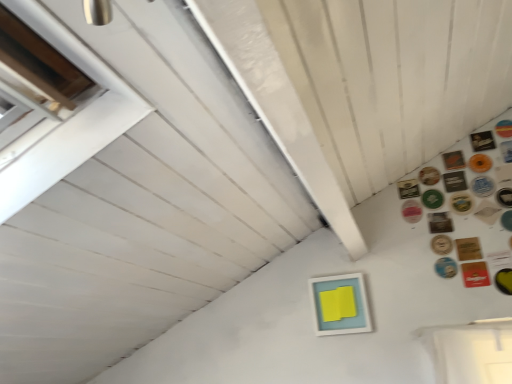
What do you see at coordinates (429, 176) in the screenshot?
I see `gold metallic coaster at upper right, marked as the fourth button in a top-to-bottom arrangement` at bounding box center [429, 176].

What is the approximate height of brown leather coaster at upper right, the eighth button viewed from the top?

3.78 inches.

You are a GUI agent. You are given a task and a screenshot of the screen. Output one action in this format:
    pyautogui.click(x=<x>, y=<y>)
    Task: Click on the brown leather coaster at upper right, which ranks as the 10th button in bottom-to-top order
    Image resolution: width=512 pixels, height=384 pixels.
    Given the screenshot: What is the action you would take?
    504,197

The width and height of the screenshot is (512, 384). In order to click on green matte button at upper right, placed as the ninth button when sorted from top to bottom in this screenshot , I will do `click(432, 199)`.

Describe the element at coordinates (440, 223) in the screenshot. I see `black matte button at upper right, the sixth button when ordered from bottom to top` at that location.

Image resolution: width=512 pixels, height=384 pixels. What do you see at coordinates (506, 151) in the screenshot?
I see `orange matte coaster at upper right, the sixteenth button when ordered from bottom to top` at bounding box center [506, 151].

In order to click on green rubber button at upper right, which is counted as the tenth button, starting from the top in this screenshot , I will do coord(461,203).

Locate an element on the screen. Image resolution: width=512 pixels, height=384 pixels. gold metallic coaster at upper right, marked as the fourth button in a top-to-bottom arrangement is located at coordinates (429, 176).

Which object is thinner, green matte button at upper right, placed as the ninth button when sorted from top to bottom, or gold metallic button at upper right, placed as the eleventh button when sorted from bottom to top?

gold metallic button at upper right, placed as the eleventh button when sorted from bottom to top.

Where is `the 2nd button positioned above the green matte button at upper right, placed as the ninth button when sorted from top to bottom (from a real-world perspective)`? the 2nd button positioned above the green matte button at upper right, placed as the ninth button when sorted from top to bottom (from a real-world perspective) is located at coordinates (x=408, y=189).

Considering the points (438, 190) and (404, 187), which point is in front, point (438, 190) or point (404, 187)?

Positioned in front is point (438, 190).

Does green matte button at upper right, the ninth button from the bottom, touch gold metallic button at upper right, placed as the eleventh button when sorted from bottom to top?

Yes, green matte button at upper right, the ninth button from the bottom, is with gold metallic button at upper right, placed as the eleventh button when sorted from bottom to top.

Is orange matte coaster at upper right, placed as the second button when sorted from top to bottom, at the back of wooden button at upper right, arranged as the 14th button when viewed from the top?

wooden button at upper right, arranged as the 14th button when viewed from the top, does not have its back to orange matte coaster at upper right, placed as the second button when sorted from top to bottom.

Do you think wooden button at upper right, the 4th button ordered from the bottom, is within orange matte coaster at upper right, placed as the second button when sorted from top to bottom, or outside of it?

wooden button at upper right, the 4th button ordered from the bottom, is not inside orange matte coaster at upper right, placed as the second button when sorted from top to bottom, it's outside.

Who is taller, wooden button at upper right, arranged as the 14th button when viewed from the top, or orange matte coaster at upper right, placed as the second button when sorted from top to bottom?

orange matte coaster at upper right, placed as the second button when sorted from top to bottom, is taller.

Between wooden button at upper right, arranged as the 14th button when viewed from the top, and orange matte coaster at upper right, placed as the second button when sorted from top to bottom, which one has larger size?

With larger size is orange matte coaster at upper right, placed as the second button when sorted from top to bottom.

From the image's perspective, between gold metallic coaster at upper right, marked as the fourth button in a top-to-bottom arrangement, and brown leather coaster at upper right, the third button when ordered from top to bottom, who is located below?

gold metallic coaster at upper right, marked as the fourth button in a top-to-bottom arrangement, appears lower in the image.

From a real-world perspective, relative to brown leather coaster at upper right, the third button when ordered from top to bottom, is gold metallic coaster at upper right, marked as the 14th button in a bottom-to-top arrangement, vertically above or below?

gold metallic coaster at upper right, marked as the 14th button in a bottom-to-top arrangement, is situated lower than brown leather coaster at upper right, the third button when ordered from top to bottom, in the real world.

Does gold metallic coaster at upper right, marked as the 14th button in a bottom-to-top arrangement, have a larger size compared to brown leather coaster at upper right, which is counted as the fifteenth button, starting from the bottom?

Yes, gold metallic coaster at upper right, marked as the 14th button in a bottom-to-top arrangement, is bigger than brown leather coaster at upper right, which is counted as the fifteenth button, starting from the bottom.

Is gold metallic button at upper right, the 7th button positioned from the top, oriented towards red cardboard button at upper right, positioned as the sixteenth button in top-to-bottom order?

A: No, gold metallic button at upper right, the 7th button positioned from the top, is not oriented towards red cardboard button at upper right, positioned as the sixteenth button in top-to-bottom order.

From the picture: In terms of height, does gold metallic button at upper right, the 7th button positioned from the top, look taller or shorter compared to red cardboard button at upper right, which is the 2th button from bottom to top?

In the image, gold metallic button at upper right, the 7th button positioned from the top, appears to be shorter than red cardboard button at upper right, which is the 2th button from bottom to top.

Is gold metallic button at upper right, the 7th button positioned from the top, in front of or behind red cardboard button at upper right, positioned as the sixteenth button in top-to-bottom order, in the image?

In the image, gold metallic button at upper right, the 7th button positioned from the top, appears behind red cardboard button at upper right, positioned as the sixteenth button in top-to-bottom order.

There is a red cardboard button at upper right, which is the 2th button from bottom to top. Find the location of `the 10th button above it (from a real-world perspective)`. the 10th button above it (from a real-world perspective) is located at coordinates (408, 189).

From the image's perspective, which is above, red cardboard button at upper right, which is the 2th button from bottom to top, or brown leather coaster at upper right, which ranks as the 10th button in bottom-to-top order?

brown leather coaster at upper right, which ranks as the 10th button in bottom-to-top order, is shown above in the image.

Considering the sizes of red cardboard button at upper right, positioned as the sixteenth button in top-to-bottom order, and brown leather coaster at upper right, which ranks as the 10th button in bottom-to-top order, in the image, is red cardboard button at upper right, positioned as the sixteenth button in top-to-bottom order, wider or thinner than brown leather coaster at upper right, which ranks as the 10th button in bottom-to-top order,?

Clearly, red cardboard button at upper right, positioned as the sixteenth button in top-to-bottom order, has more width compared to brown leather coaster at upper right, which ranks as the 10th button in bottom-to-top order.

From the picture: Which object is positioned more to the right, red cardboard button at upper right, which is the 2th button from bottom to top, or brown leather coaster at upper right, which ranks as the 10th button in bottom-to-top order?

Positioned to the right is brown leather coaster at upper right, which ranks as the 10th button in bottom-to-top order.

Which is closer, (465, 263) or (508, 197)?

The point (465, 263) is closer.

Which of these two, light blue matte picture frame at center or black matte button at upper right, the 12th button positioned from the top, stands shorter?

black matte button at upper right, the 12th button positioned from the top, is shorter.

In the scene shown: Considering the sizes of light blue matte picture frame at center and black matte button at upper right, the 12th button positioned from the top, in the image, is light blue matte picture frame at center bigger or smaller than black matte button at upper right, the 12th button positioned from the top,?

light blue matte picture frame at center is bigger than black matte button at upper right, the 12th button positioned from the top.

Between point (337, 284) and point (430, 221), which one is positioned in front?

Point (430, 221)

Is light blue matte picture frame at center oriented away from black matte button at upper right, the sixth button when ordered from bottom to top?

No, black matte button at upper right, the sixth button when ordered from bottom to top, is not at the back of light blue matte picture frame at center.

Does matte brown button at upper right, which ranks as the fifth button in bottom-to-top order, have a lesser width compared to blue glossy button at upper right, which is the sixth button from top to bottom?

In fact, matte brown button at upper right, which ranks as the fifth button in bottom-to-top order, might be wider than blue glossy button at upper right, which is the sixth button from top to bottom.

Looking at this image, from a real-world perspective, who is located lower, matte brown button at upper right, positioned as the thirteenth button in top-to-bottom order, or blue glossy button at upper right, which ranks as the 12th button in bottom-to-top order?

matte brown button at upper right, positioned as the thirteenth button in top-to-bottom order, is physically lower.

Which is correct: matte brown button at upper right, which ranks as the fifth button in bottom-to-top order, is inside blue glossy button at upper right, which ranks as the 12th button in bottom-to-top order, or outside of it?

matte brown button at upper right, which ranks as the fifth button in bottom-to-top order, is outside blue glossy button at upper right, which ranks as the 12th button in bottom-to-top order.

Which of these two, matte brown button at upper right, which ranks as the fifth button in bottom-to-top order, or blue glossy button at upper right, which ranks as the 12th button in bottom-to-top order, is smaller?

Smaller between the two is blue glossy button at upper right, which ranks as the 12th button in bottom-to-top order.

Where is `the 2nd button located above the green matte button at upper right, the ninth button from the bottom (from a real-world perspective)`? the 2nd button located above the green matte button at upper right, the ninth button from the bottom (from a real-world perspective) is located at coordinates (408, 189).

Locate an element on the screen. The width and height of the screenshot is (512, 384). the 12th button above the wooden button at upper right, arranged as the 14th button when viewed from the top (from the image's perspective) is located at coordinates (506, 151).

Estimate the real-world distances between objects in this image. Which object is closer to pink glossy button at upper right, which is the 7th button from bottom to top, light blue matte picture frame at center or brown leather coaster at upper right, positioned as the thirteenth button in bottom-to-top order?

brown leather coaster at upper right, positioned as the thirteenth button in bottom-to-top order.

Considering their positions, is pink glossy button at upper right, arranged as the 11th button when viewed from the top, positioned further to brown leather coaster at upper right, which ranks as the 10th button in bottom-to-top order, than blue metallic button at lower right, positioned as the third button in bottom-to-top order?

blue metallic button at lower right, positioned as the third button in bottom-to-top order, lies further to brown leather coaster at upper right, which ranks as the 10th button in bottom-to-top order, than the other object.

Estimate the real-world distances between objects in this image. Which object is further from green matte button at upper right, the ninth button from the bottom, gold metallic button at upper right, placed as the eleventh button when sorted from bottom to top, or yellow rubber at upper right, which ranks as the 1th button in bottom-to-top order?

yellow rubber at upper right, which ranks as the 1th button in bottom-to-top order, is further to green matte button at upper right, the ninth button from the bottom.

From the image, which object appears to be farther from yellow rubber at upper right, which appears as the 17th button when viewed from the top, gold metallic coaster at upper right, marked as the 14th button in a bottom-to-top arrangement, or black matte button at upper right, the sixth button when ordered from bottom to top?

gold metallic coaster at upper right, marked as the 14th button in a bottom-to-top arrangement, is further to yellow rubber at upper right, which appears as the 17th button when viewed from the top.

When comparing their distances from yellow rubber at upper right, which appears as the 17th button when viewed from the top, does blue metallic button at lower right, positioned as the third button in bottom-to-top order, or green matte button at upper right, the ninth button from the bottom, seem further?

Among the two, green matte button at upper right, the ninth button from the bottom, is located further to yellow rubber at upper right, which appears as the 17th button when viewed from the top.

Which object lies further to the anchor point brown leather coaster at upper right, the eighth button viewed from the top, gold metallic coaster at upper right, marked as the 14th button in a bottom-to-top arrangement, or pink glossy button at upper right, which is the 7th button from bottom to top?

Among the two, pink glossy button at upper right, which is the 7th button from bottom to top, is located further to brown leather coaster at upper right, the eighth button viewed from the top.

From the image, which object appears to be farther from matte brown button at upper right, which ranks as the fifth button in bottom-to-top order, wooden button at upper right, arranged as the 14th button when viewed from the top, or brown leather coaster at upper right, which ranks as the 10th button in bottom-to-top order?

Among the two, brown leather coaster at upper right, which ranks as the 10th button in bottom-to-top order, is located further to matte brown button at upper right, which ranks as the fifth button in bottom-to-top order.

Based on their spatial positions, is orange matte coaster at upper right, the sixteenth button when ordered from bottom to top, or green matte button at upper right, placed as the ninth button when sorted from top to bottom, further from gold metallic coaster at upper right, marked as the 14th button in a bottom-to-top arrangement?

orange matte coaster at upper right, the sixteenth button when ordered from bottom to top, is positioned further to the anchor gold metallic coaster at upper right, marked as the 14th button in a bottom-to-top arrangement.

At what (x,y) coordinates should I click in order to perform the action: click on button between pink glossy button at upper right, which is the 7th button from bottom to top, and matte brown button at upper right, which ranks as the fifth button in bottom-to-top order, in the up-down direction. Please return your answer as a coordinate pair (x, y). This screenshot has width=512, height=384. Looking at the image, I should click on (440, 223).